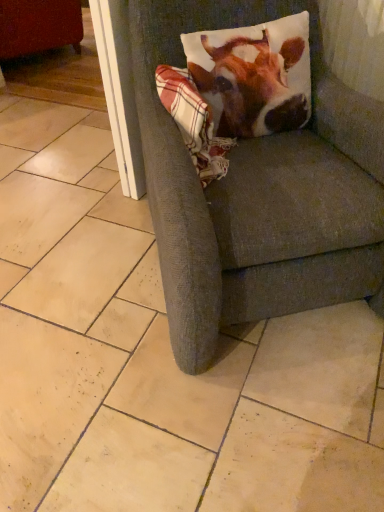
This screenshot has width=384, height=512. I want to click on vacant area in front of textured gray armchair at center, so click(208, 424).